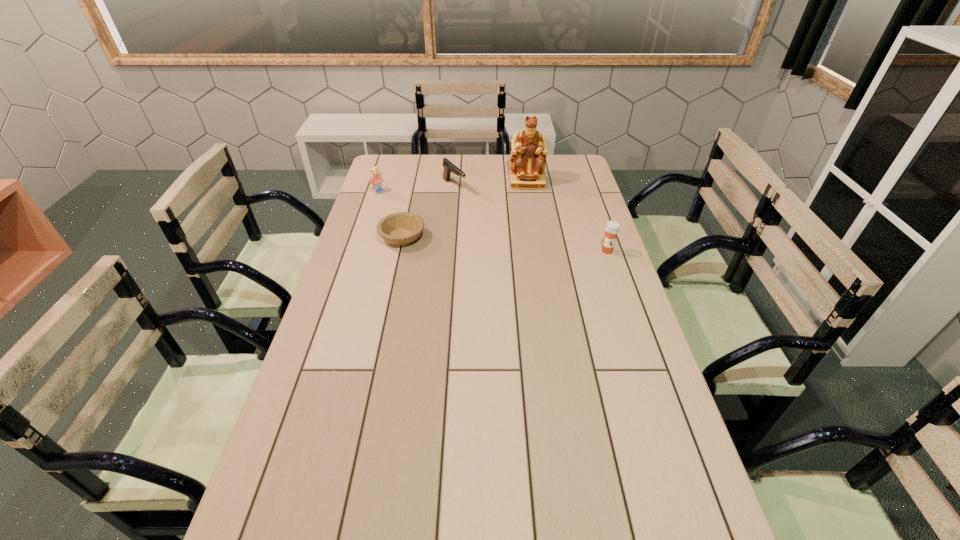
You are a GUI agent. You are given a task and a screenshot of the screen. Output one action in this format:
    pyautogui.click(x=<x>, y=<y>)
    Task: Click on the bowl that is at the left edge
    This screenshot has width=960, height=540.
    Given the screenshot: What is the action you would take?
    pyautogui.click(x=401, y=228)

You are a GUI agent. You are given a task and a screenshot of the screen. Output one action in this format:
    pyautogui.click(x=<x>, y=<y>)
    Task: Click on the Lego located at the left edge
    This screenshot has width=960, height=540.
    Given the screenshot: What is the action you would take?
    pyautogui.click(x=375, y=180)

The image size is (960, 540). In order to click on object at the right edge in this screenshot , I will do [612, 228].

Where is `free spot at the near edge of the desktop`? The height and width of the screenshot is (540, 960). free spot at the near edge of the desktop is located at coordinates (354, 523).

Image resolution: width=960 pixels, height=540 pixels. I want to click on blank space at the left edge, so click(304, 393).

Where is `vacant space at the right edge`? vacant space at the right edge is located at coordinates (649, 435).

This screenshot has width=960, height=540. Identify the location of vacant position at the far left corner of the desktop. (383, 156).

This screenshot has height=540, width=960. In order to click on vacant area that lies between the bowl and the rightmost object in this screenshot , I will do `click(505, 244)`.

Where is `free point between the second object from right to left and the bowl`? free point between the second object from right to left and the bowl is located at coordinates (465, 210).

In order to click on unoccupied position between the pistol and the rightmost object in this screenshot , I will do `click(531, 219)`.